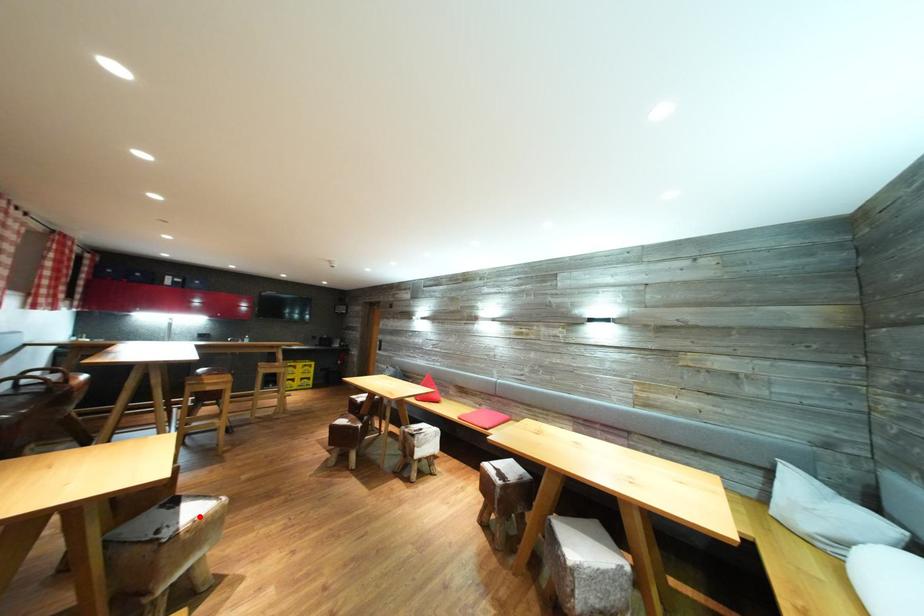
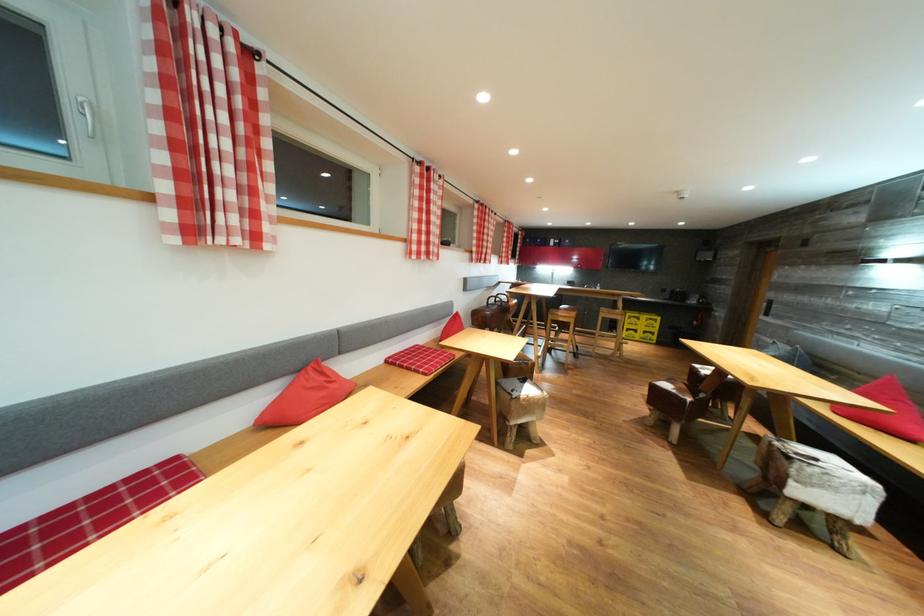
The point at the highlighted location is marked in the first image. Where is the corresponding point in the second image?

(536, 395)